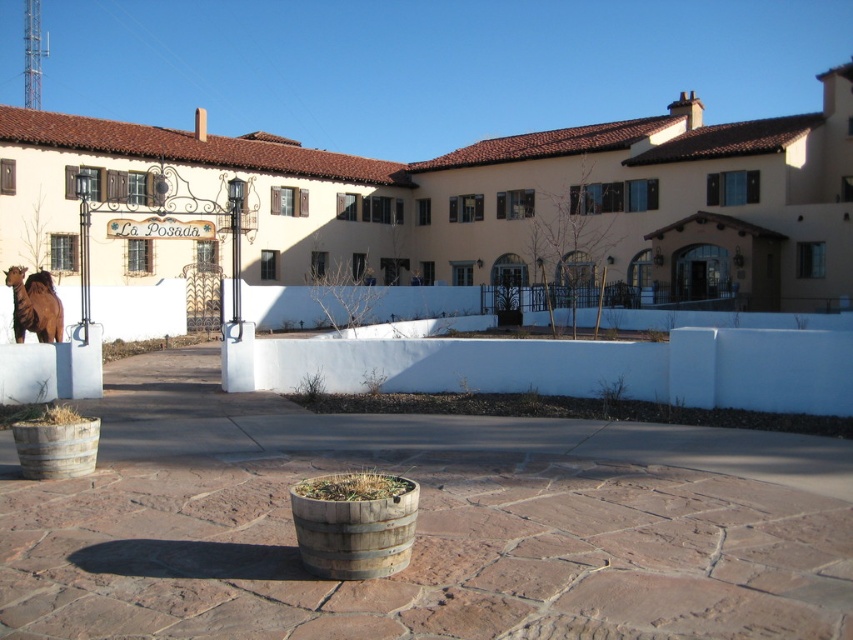
Question: Among these objects, which one is farthest from the camera?

Choices:
 (A) rustic wooden barrel at lower left
 (B) brown matte camel at left
 (C) rustic wood barrel at center

Answer: (B)

Question: Can you confirm if brown matte camel at left is wider than brown wooden hay at center?

Choices:
 (A) no
 (B) yes

Answer: (B)

Question: Is rustic wood barrel at center below brown straw at lower left?

Choices:
 (A) yes
 (B) no

Answer: (A)

Question: Which object appears closest to the camera in this image?

Choices:
 (A) brown matte camel at left
 (B) rustic wooden barrel at lower left
 (C) brown wooden hay at center

Answer: (C)

Question: Does rustic wooden barrel at lower left have a lesser width compared to brown matte camel at left?

Choices:
 (A) no
 (B) yes

Answer: (B)

Question: Which object appears farthest from the camera in this image?

Choices:
 (A) rustic wooden barrel at lower left
 (B) rustic wood barrel at center

Answer: (A)